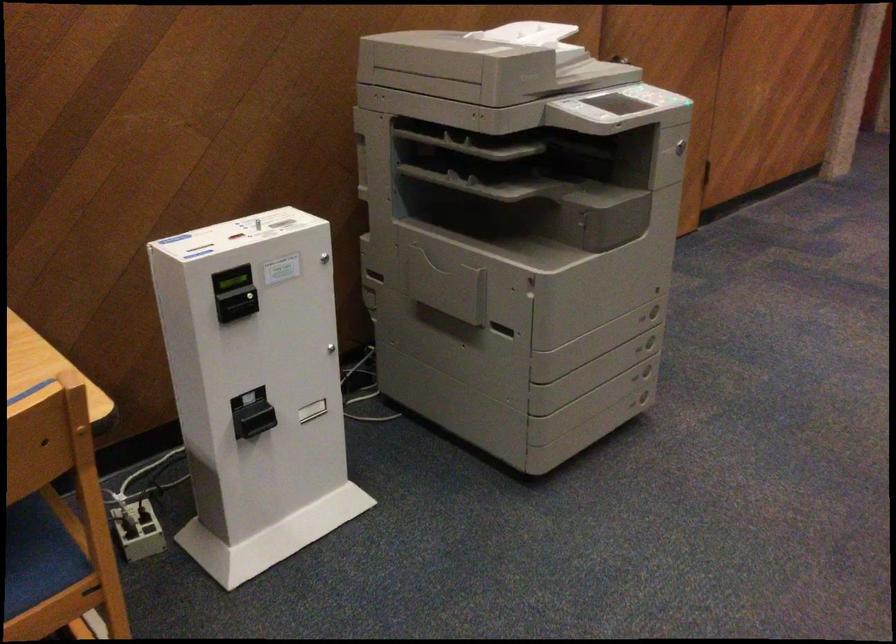
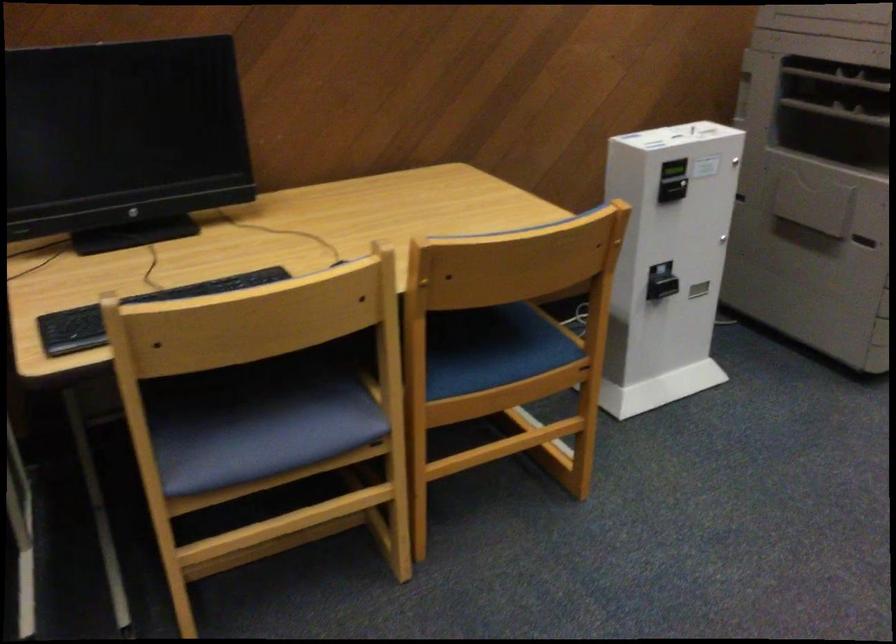
The point at [238,285] is marked in the first image. Where is the corresponding point in the second image?

(673, 169)